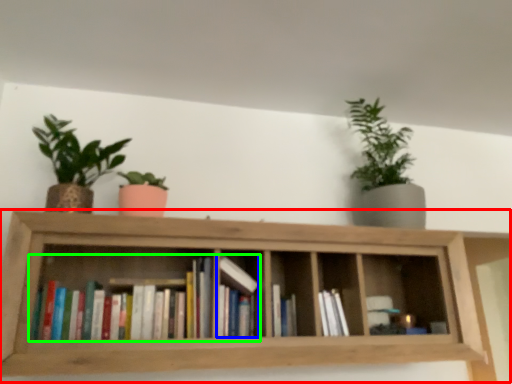
Question: Which object is the farthest from shelf (highlighted by a red box)? Choose among these: book (highlighted by a blue box) or book (highlighted by a green box).

Choices:
 (A) book
 (B) book

Answer: (A)